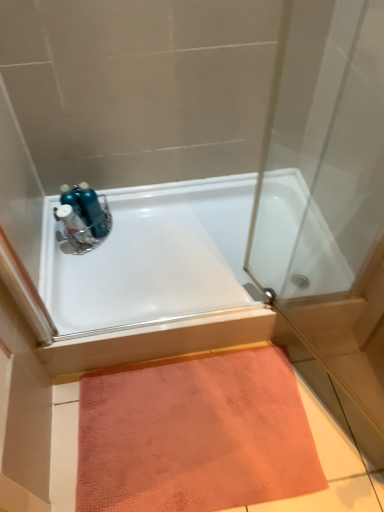
Where is `spots to the right of blue metallic bottles at upper left`? The height and width of the screenshot is (512, 384). spots to the right of blue metallic bottles at upper left is located at coordinates (142, 226).